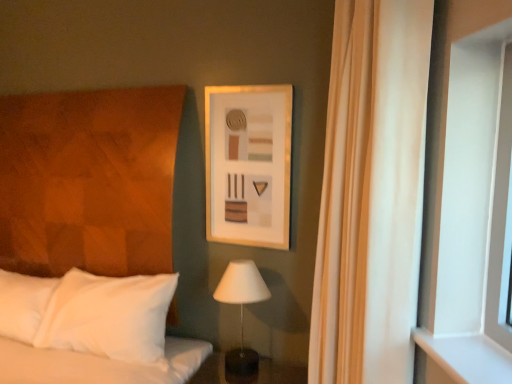
Question: Is matte wooden picture frame at upper center to the right of white matte table lamp at center from the viewer's perspective?

Choices:
 (A) yes
 (B) no

Answer: (A)

Question: Is matte wooden picture frame at upper center positioned beyond the bounds of white matte table lamp at center?

Choices:
 (A) no
 (B) yes

Answer: (B)

Question: From the image's perspective, is matte wooden picture frame at upper center under white matte table lamp at center?

Choices:
 (A) no
 (B) yes

Answer: (A)

Question: Is matte wooden picture frame at upper center at the left side of white matte table lamp at center?

Choices:
 (A) no
 (B) yes

Answer: (A)

Question: From a real-world perspective, does matte wooden picture frame at upper center sit lower than white matte table lamp at center?

Choices:
 (A) no
 (B) yes

Answer: (A)

Question: In the image, is matte wooden picture frame at upper center positioned in front of or behind white matte table lamp at center?

Choices:
 (A) behind
 (B) front

Answer: (A)

Question: Considering the positions of matte wooden picture frame at upper center and white matte table lamp at center in the image, is matte wooden picture frame at upper center wider or thinner than white matte table lamp at center?

Choices:
 (A) thin
 (B) wide

Answer: (A)

Question: Considering the positions of matte wooden picture frame at upper center and white matte table lamp at center in the image, is matte wooden picture frame at upper center bigger or smaller than white matte table lamp at center?

Choices:
 (A) small
 (B) big

Answer: (A)

Question: In the image, is matte wooden picture frame at upper center on the left side or the right side of white matte table lamp at center?

Choices:
 (A) left
 (B) right

Answer: (B)

Question: Is matte wooden picture frame at upper center bigger or smaller than beige fabric curtain at right?

Choices:
 (A) small
 (B) big

Answer: (A)

Question: Is matte wooden picture frame at upper center inside or outside of beige fabric curtain at right?

Choices:
 (A) inside
 (B) outside

Answer: (B)

Question: Does point (272, 148) appear closer or farther from the camera than point (340, 36)?

Choices:
 (A) farther
 (B) closer

Answer: (A)

Question: From their relative heights in the image, would you say matte wooden picture frame at upper center is taller or shorter than beige fabric curtain at right?

Choices:
 (A) tall
 (B) short

Answer: (B)

Question: Would you say white matte table lamp at center is to the left or to the right of white matte window at right in the picture?

Choices:
 (A) right
 (B) left

Answer: (B)

Question: From the image's perspective, is white matte table lamp at center located above or below white matte window at right?

Choices:
 (A) below
 (B) above

Answer: (A)